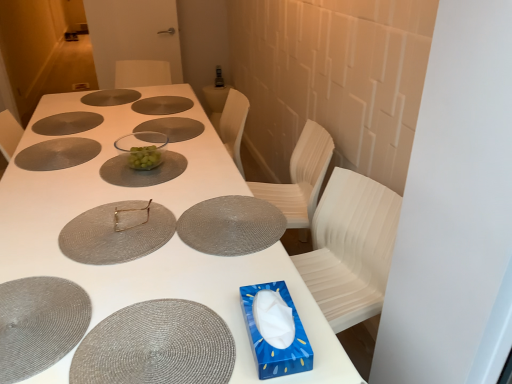
Identify the location of vacant area that lies between matte gray placemat at center, arranged as the second glass plate when viewed from the front, and transparent glass bowl at center. (126, 183).